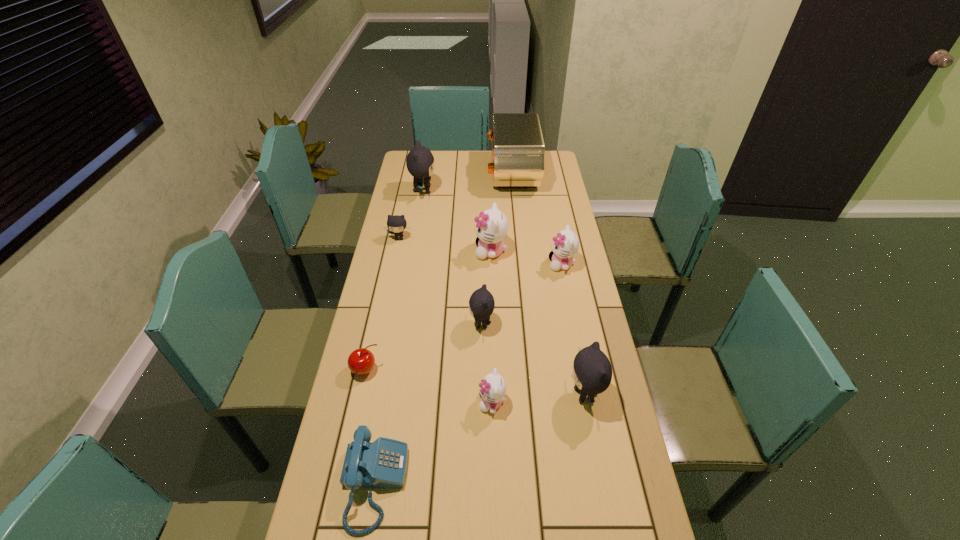
Where is `gray kitten that stands as the second closest to the blue telephone`? The height and width of the screenshot is (540, 960). gray kitten that stands as the second closest to the blue telephone is located at coordinates (592, 372).

Choose which white kitten is the nearest neighbor to the second biggest white kitten. Please provide its 2D coordinates. Your answer should be formatted as a tuple, i.e. [(x, y)], where the tuple contains the x and y coordinates of a point satisfying the conditions above.

[(492, 226)]

Find the location of a particular element. The height and width of the screenshot is (540, 960). the second closest white kitten to the biggest gray kitten is located at coordinates (565, 245).

This screenshot has width=960, height=540. In order to click on vacant space that satisfies the following two spatial constraints: 1. on the front-facing side of the biggest gray kitten; 2. on the front-facing side of the second farthest gray kitten in this screenshot , I will do coord(416,238).